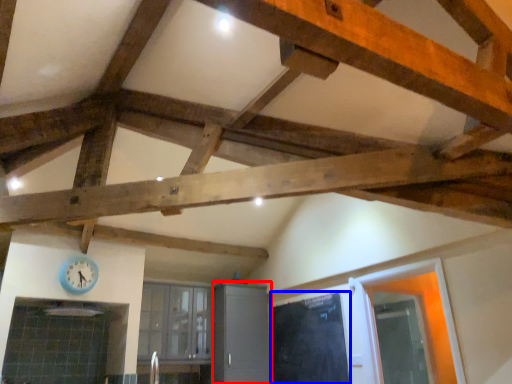
Question: Which object appears farthest to the camera in this image, cabinetry (highlighted by a red box) or door (highlighted by a blue box)?

Choices:
 (A) cabinetry
 (B) door

Answer: (A)